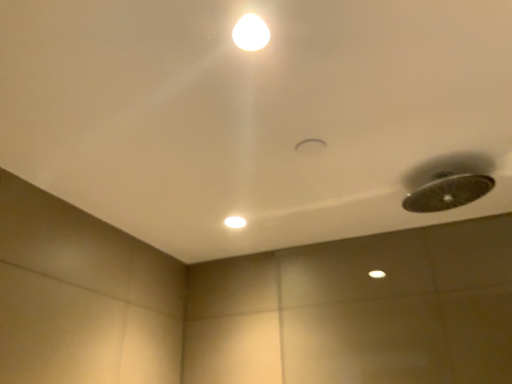
Question: Can you confirm if white glossy light at upper center is smaller than matte white light at center?

Choices:
 (A) yes
 (B) no

Answer: (A)

Question: Is white glossy light at upper center at the right side of matte white light at center?

Choices:
 (A) yes
 (B) no

Answer: (A)

Question: Is the position of white glossy light at upper center more distant than that of matte white light at center?

Choices:
 (A) yes
 (B) no

Answer: (B)

Question: From the image's perspective, would you say white glossy light at upper center is positioned over matte white light at center?

Choices:
 (A) yes
 (B) no

Answer: (A)

Question: Does white glossy light at upper center lie in front of matte white light at center?

Choices:
 (A) no
 (B) yes

Answer: (B)

Question: Could matte white light at center be considered to be inside white glossy light at upper center?

Choices:
 (A) yes
 (B) no

Answer: (B)

Question: Can you see matte white light at center touching white glossy light at upper center?

Choices:
 (A) no
 (B) yes

Answer: (A)

Question: Considering the relative positions of matte white light at center and white glossy light at upper center in the image provided, is matte white light at center in front of white glossy light at upper center?

Choices:
 (A) yes
 (B) no

Answer: (B)

Question: From a real-world perspective, is matte white light at center located beneath white glossy light at upper center?

Choices:
 (A) no
 (B) yes

Answer: (B)

Question: From a real-world perspective, is matte white light at center physically above white glossy light at upper center?

Choices:
 (A) no
 (B) yes

Answer: (A)

Question: Is matte white light at center not near white glossy light at upper center?

Choices:
 (A) yes
 (B) no

Answer: (B)

Question: Can you confirm if matte white light at center is positioned to the right of white glossy light at upper center?

Choices:
 (A) yes
 (B) no

Answer: (B)

Question: From a real-world perspective, is matte white light at center positioned above or below white glossy light at upper center?

Choices:
 (A) below
 (B) above

Answer: (A)